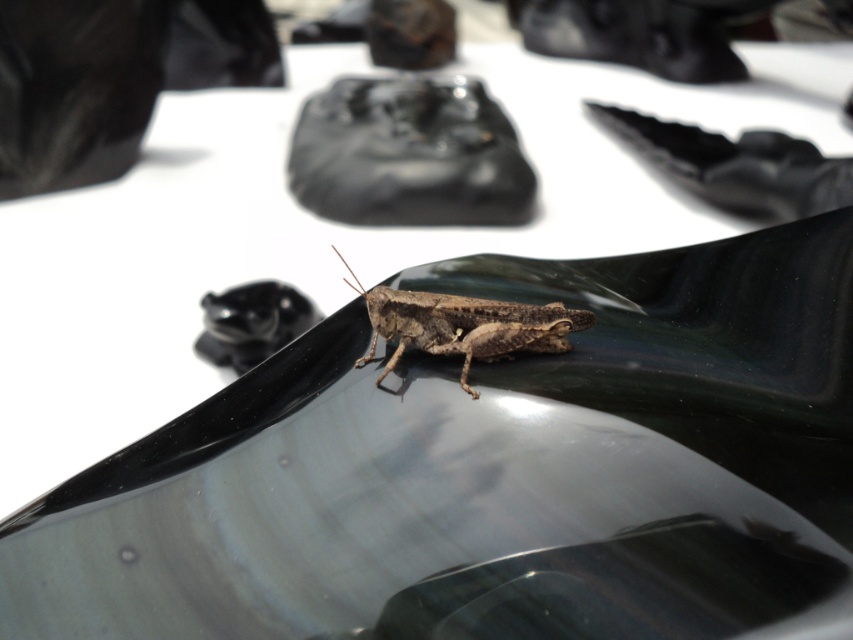
You are standing in front of the sculptural piece and notice the black glossy shoe at upper center. Where exactly is it positioned on the surface?

The black glossy shoe at upper center is located at point coordinates of 0.258 on the x axis and 0.864 on the y axis.

You are standing 6 feet away from a grasshopper on a dark surface. You want to take a photo of the grasshopper using a camera. If the camera is at point [666,152], will you be able to capture the grasshopper in the photo?

The camera at point [666,152] is 5.36 feet away from the grasshopper. Since you are standing 6 feet away, the distance between you and the camera is 0.64 feet. Therefore, the grasshopper is within the camera range and can be captured in the photo.